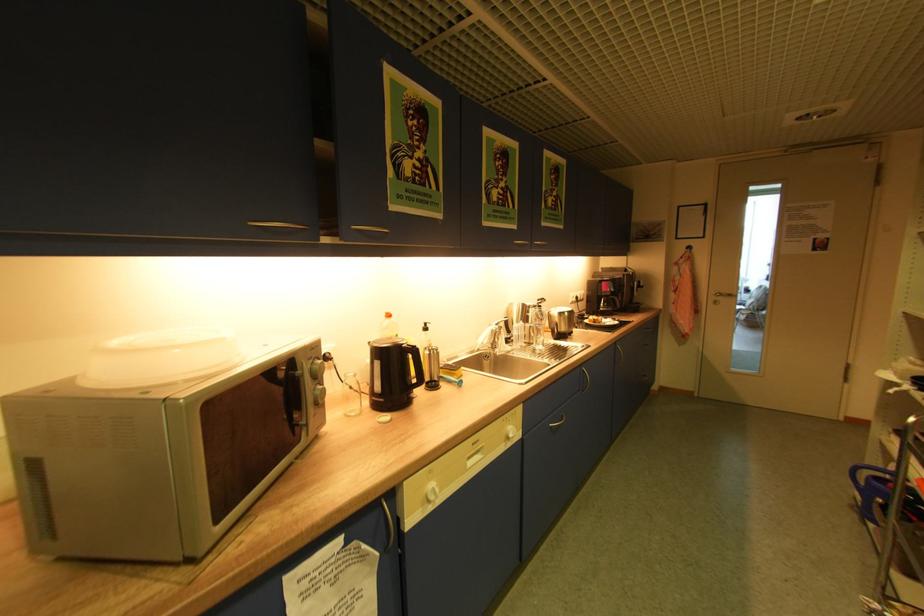
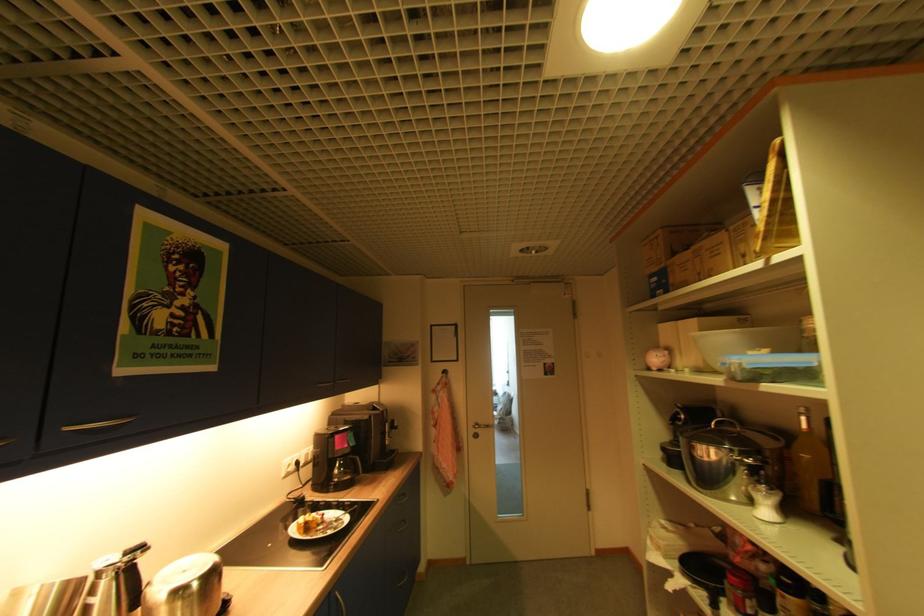
Find the pixel in the second image that matches point (622, 344) in the first image.

(335, 593)